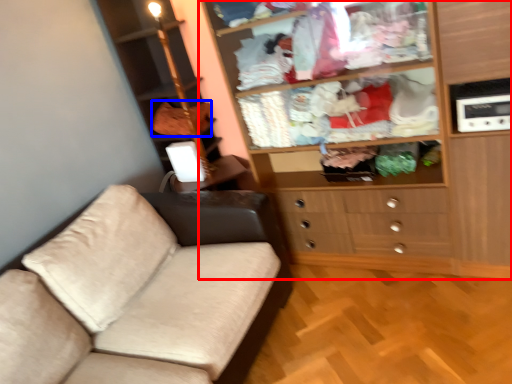
Question: Among these objects, which one is farthest to the camera, cupboard (highlighted by a red box) or clothing (highlighted by a blue box)?

Choices:
 (A) cupboard
 (B) clothing

Answer: (B)